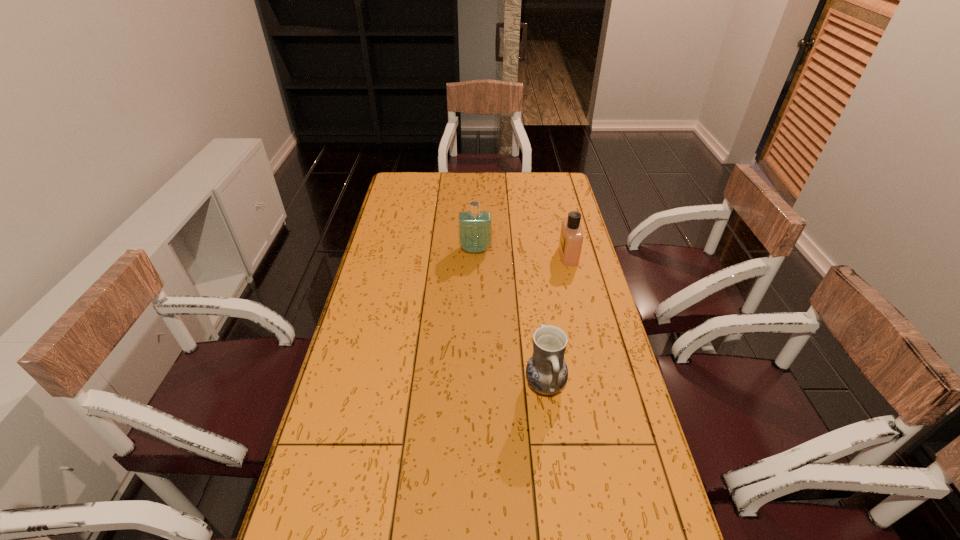
This screenshot has width=960, height=540. In the image, there is a desktop. What are the coordinates of `vacant area at the far edge` in the screenshot? It's located at (487, 184).

At what (x,y) coordinates should I click in order to perform the action: click on free location at the left edge of the desktop. Please return your answer as a coordinate pair (x, y). Looking at the image, I should click on (377, 367).

Where is `vacant space at the right edge of the desktop`? This screenshot has height=540, width=960. vacant space at the right edge of the desktop is located at coordinates (560, 199).

Where is `vacant space at the far left corner`? Image resolution: width=960 pixels, height=540 pixels. vacant space at the far left corner is located at coordinates (408, 173).

In the image, there is a desktop. Where is `free region at the far right corner`? This screenshot has height=540, width=960. free region at the far right corner is located at coordinates (545, 177).

Find the location of a particular element. The width and height of the screenshot is (960, 540). vacant space that is in between the right perfume and the left perfume is located at coordinates (522, 252).

You are a GUI agent. You are given a task and a screenshot of the screen. Output one action in this format:
    pyautogui.click(x=<x>, y=<y>)
    Task: Click on the free space between the nearest object and the leftmost object
    Image resolution: width=960 pixels, height=540 pixels.
    Given the screenshot: What is the action you would take?
    pyautogui.click(x=510, y=318)

You are a GUI agent. You are given a task and a screenshot of the screen. Output one action in this format:
    pyautogui.click(x=<x>, y=<y>)
    Task: Click on the vacant area that lies between the leftmost object and the pottery
    The width and height of the screenshot is (960, 540).
    Given the screenshot: What is the action you would take?
    pyautogui.click(x=510, y=318)

The image size is (960, 540). What are the coordinates of `vacant space that's between the leftmost object and the nearest object` in the screenshot? It's located at (510, 318).

You are a GUI agent. You are given a task and a screenshot of the screen. Output one action in this format:
    pyautogui.click(x=<x>, y=<y>)
    Task: Click on the free space between the rightmost object and the nearest object
    The height and width of the screenshot is (540, 960).
    Given the screenshot: What is the action you would take?
    pyautogui.click(x=557, y=320)